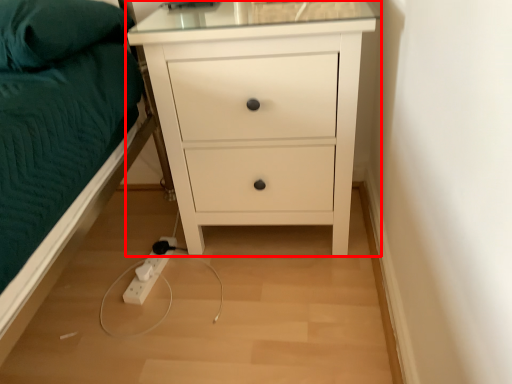
Question: From the image's perspective, what is the correct spatial positioning of chest of drawers (annotated by the red box) in reference to pillow?

Choices:
 (A) below
 (B) above

Answer: (A)